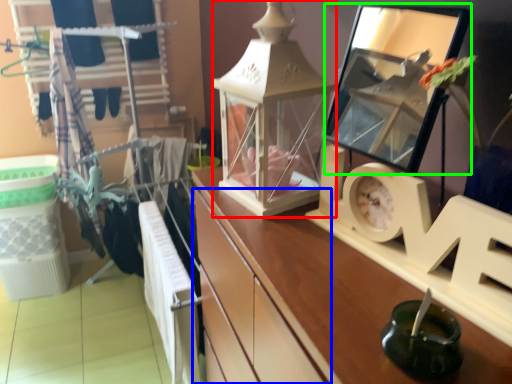
Question: Based on their relative distances, which object is farther from writing (highlighted by a red box)? Choose from drawer (highlighted by a blue box) and mirror (highlighted by a green box).

Choices:
 (A) drawer
 (B) mirror

Answer: (B)